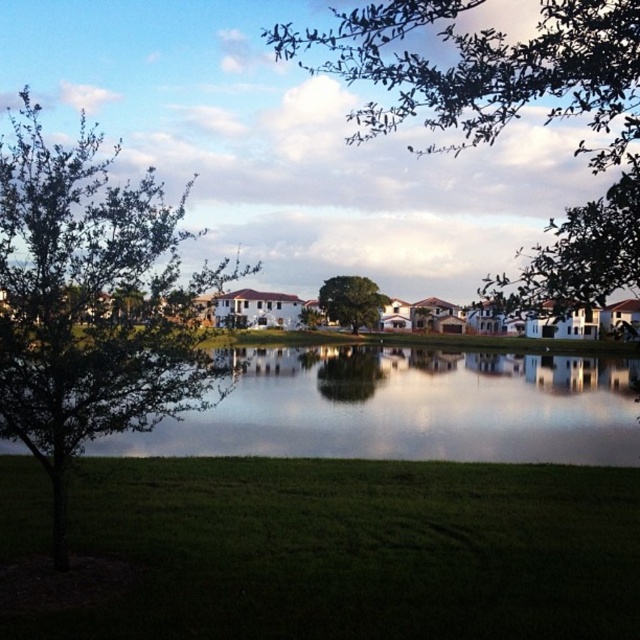
You are a landscape architect designing a garden path that needs to pass between the green leafy tree at left and the green leafy tree at upper center. Based on their widths, which tree requires more space to avoid damaging its roots?

The green leafy tree at upper center requires more space because it has a greater width than the green leafy tree at left, necessitating a wider path to avoid root damage.

You are a landscape architect analyzing the suburban scene. You need to determine which tree, the green leafy tree at upper center or the green leafy tree at center, would cast a larger shadow during the day. Based on their sizes, which one would you expect to have a bigger shadow?

The green leafy tree at upper center has a larger size compared to the green leafy tree at center, so it would cast a larger shadow during the day.